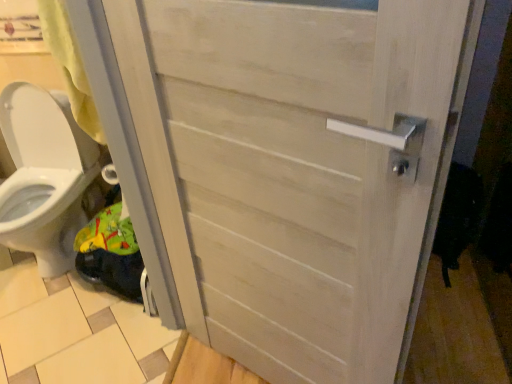
Question: Is white glossy toilet at lower left facing away from beige wood tile at lower left?

Choices:
 (A) no
 (B) yes

Answer: (A)

Question: Is white glossy toilet at lower left not near beige wood tile at lower left?

Choices:
 (A) no
 (B) yes

Answer: (A)

Question: Considering the relative sizes of white glossy toilet at lower left and beige wood tile at lower left in the image provided, is white glossy toilet at lower left bigger than beige wood tile at lower left?

Choices:
 (A) no
 (B) yes

Answer: (B)

Question: Considering the relative positions of white glossy toilet at lower left and beige wood tile at lower left in the image provided, is white glossy toilet at lower left to the left of beige wood tile at lower left from the viewer's perspective?

Choices:
 (A) yes
 (B) no

Answer: (A)

Question: Considering the relative sizes of white glossy toilet at lower left and beige wood tile at lower left in the image provided, is white glossy toilet at lower left shorter than beige wood tile at lower left?

Choices:
 (A) yes
 (B) no

Answer: (B)

Question: Does point (411, 317) appear closer or farther from the camera than point (167, 339)?

Choices:
 (A) closer
 (B) farther

Answer: (A)

Question: Is white wood door at center inside or outside of beige wood tile at lower left?

Choices:
 (A) inside
 (B) outside

Answer: (B)

Question: Looking at their shapes, would you say white wood door at center is wider or thinner than beige wood tile at lower left?

Choices:
 (A) wide
 (B) thin

Answer: (B)

Question: From a real-world perspective, is white wood door at center above or below beige wood tile at lower left?

Choices:
 (A) above
 (B) below

Answer: (A)

Question: From a real-world perspective, is white wood door at center above or below white glossy toilet at lower left?

Choices:
 (A) below
 (B) above

Answer: (B)

Question: From the image's perspective, relative to white glossy toilet at lower left, is white wood door at center above or below?

Choices:
 (A) below
 (B) above

Answer: (A)

Question: Considering the positions of white wood door at center and white glossy toilet at lower left in the image, is white wood door at center wider or thinner than white glossy toilet at lower left?

Choices:
 (A) wide
 (B) thin

Answer: (B)

Question: Considering the positions of point (381, 357) and point (36, 94), is point (381, 357) closer or farther from the camera than point (36, 94)?

Choices:
 (A) closer
 (B) farther

Answer: (A)

Question: From their relative heights in the image, would you say beige wood tile at lower left is taller or shorter than white glossy toilet at lower left?

Choices:
 (A) tall
 (B) short

Answer: (B)

Question: In terms of size, does beige wood tile at lower left appear bigger or smaller than white glossy toilet at lower left?

Choices:
 (A) big
 (B) small

Answer: (B)